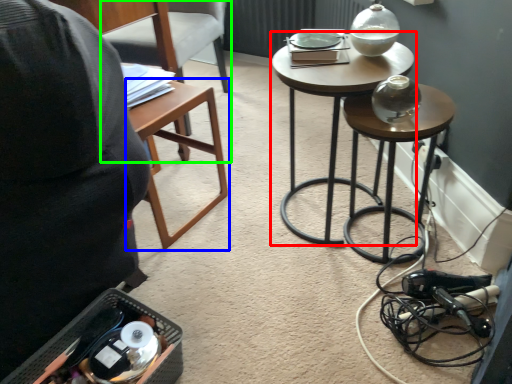
Question: Considering the real-world distances, which object is closest to stool (highlighted by a red box)? table (highlighted by a blue box) or chair (highlighted by a green box).

Choices:
 (A) table
 (B) chair

Answer: (A)